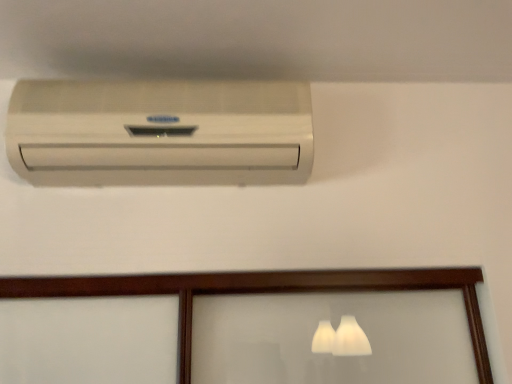
Describe the element at coordinates (160, 133) in the screenshot. I see `white matte air conditioner at upper center` at that location.

Find the location of `white matte air conditioner at upper center`. white matte air conditioner at upper center is located at coordinates (160, 133).

Where is `white matte air conditioner at upper center`? white matte air conditioner at upper center is located at coordinates (160, 133).